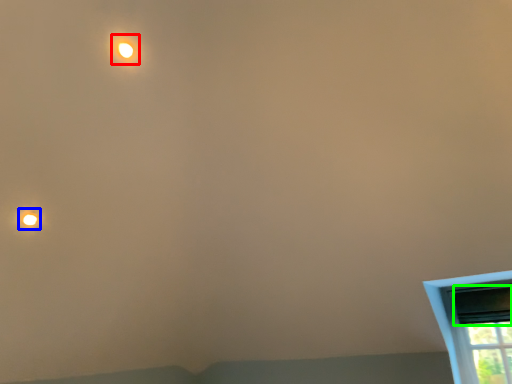
Question: Which is farther away from light (highlighted by a red box)? droplight (highlighted by a blue box) or window screen (highlighted by a green box)?

Choices:
 (A) droplight
 (B) window screen

Answer: (B)